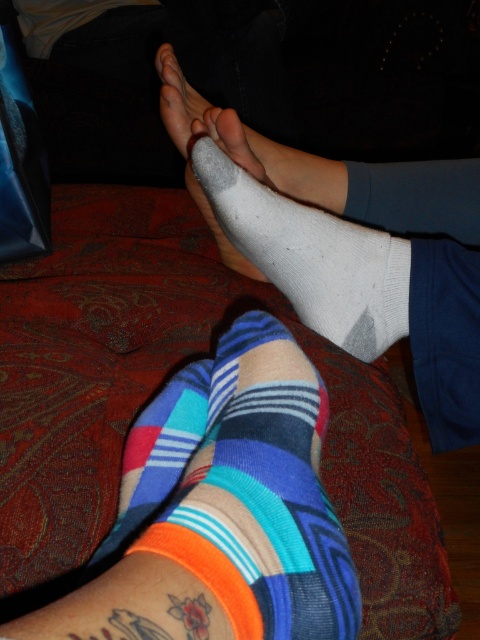
Question: Among these points, which one is farthest from the camera?

Choices:
 (A) (173, 140)
 (B) (245, 604)
 (C) (365, 310)

Answer: (A)

Question: Can you confirm if multicolored fabric socks at lower center is positioned above white cotton sock at center?

Choices:
 (A) yes
 (B) no

Answer: (B)

Question: Estimate the real-world distances between objects in this image. Which object is farther from the multicolored fabric socks at lower center?

Choices:
 (A) white cotton sock at center
 (B) white matte sock at center

Answer: (B)

Question: Which point appears closest to the camera in this image?

Choices:
 (A) (208, 205)
 (B) (287, 516)
 (C) (268, 259)

Answer: (B)

Question: Does white cotton sock at center have a lesser width compared to white matte sock at center?

Choices:
 (A) no
 (B) yes

Answer: (B)

Question: Where is multicolored fabric socks at lower center located in relation to white cotton sock at center in the image?

Choices:
 (A) below
 (B) above

Answer: (A)